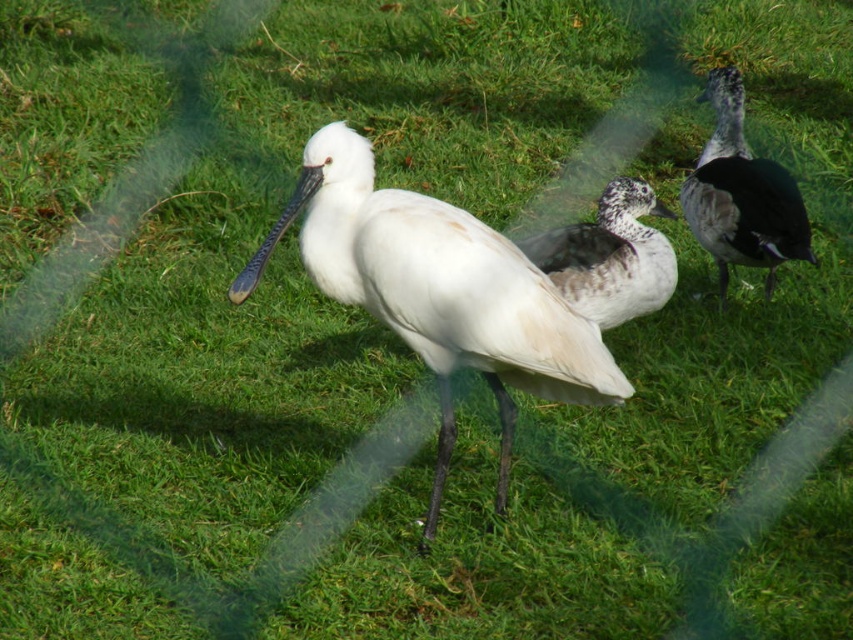
Is point (418, 323) closer to camera compared to point (576, 227)?

Yes, it is in front of point (576, 227).

Is white matte bird at center in front of speckled white duck at center?

Yes, it is in front of speckled white duck at center.

Does point (544, 291) come farther from viewer compared to point (634, 280)?

No, it is not.

Where is `white matte bird at center`? white matte bird at center is located at coordinates (438, 292).

Is speckled gray duck at right below speckled white duck at center?

Incorrect, speckled gray duck at right is not positioned below speckled white duck at center.

Who is more forward, (738, 76) or (576, 285)?

Point (576, 285) is in front.

The height and width of the screenshot is (640, 853). I want to click on speckled gray duck at right, so click(741, 195).

Between white matte bird at center and speckled gray duck at right, which one has more height?

white matte bird at center is taller.

Looking at this image, does white matte bird at center appear on the left side of speckled gray duck at right?

Correct, you'll find white matte bird at center to the left of speckled gray duck at right.

This screenshot has height=640, width=853. Describe the element at coordinates (438, 292) in the screenshot. I see `white matte bird at center` at that location.

This screenshot has width=853, height=640. What are the coordinates of `white matte bird at center` in the screenshot? It's located at (438, 292).